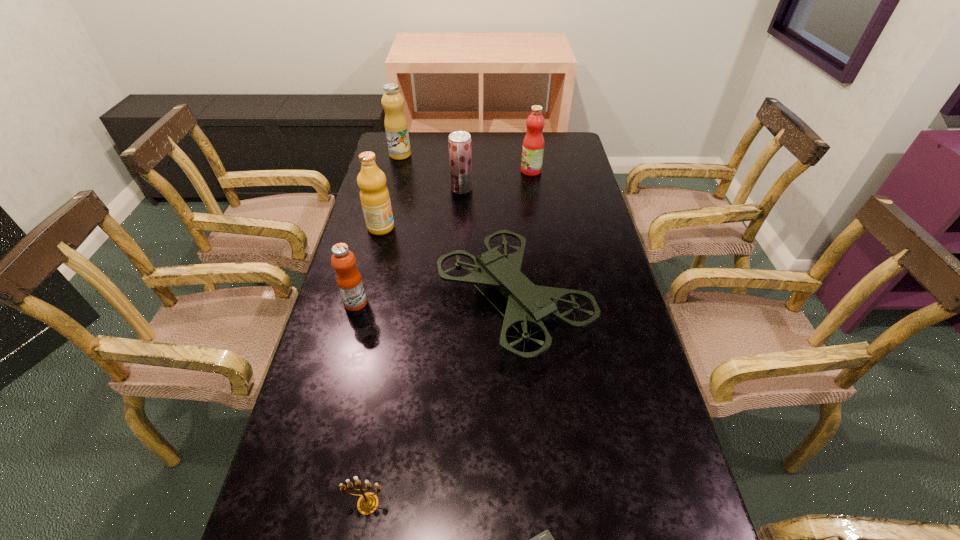
At what (x,y) coordinates should I click in order to perform the action: click on unoccupied area between the second nearest object and the farthest object. Please return your answer as a coordinate pair (x, y). Looking at the image, I should click on (384, 329).

Identify the location of empty space that is in between the nearest fruit juice and the drone. (434, 303).

At what (x,y) coordinates should I click in order to perform the action: click on free space between the candelabrum and the drone. Please return your answer as a coordinate pair (x, y). Looking at the image, I should click on (441, 403).

Locate which object ranks second in proximity to the shortest object. Please provide its 2D coordinates. Your answer should be formatted as a tuple, i.e. [(x, y)], where the tuple contains the x and y coordinates of a point satisfying the conditions above.

[(527, 303)]

Locate which object is the seventh closest to the farthest object. Please provide its 2D coordinates. Your answer should be formatted as a tuple, i.e. [(x, y)], where the tuple contains the x and y coordinates of a point satisfying the conditions above.

[(544, 539)]

Find the location of a particular element. fruit juice that is the nearest to the nearest object is located at coordinates (348, 278).

Locate an element on the screen. This screenshot has height=540, width=960. fruit juice that is the fourth closest to the farthest object is located at coordinates (x=348, y=278).

Locate an element on the screen. The height and width of the screenshot is (540, 960). free location that satisfies the following two spatial constraints: 1. on the front label of the nearest fruit juice; 2. on the back side of the fourth object from left to right is located at coordinates [x=302, y=504].

This screenshot has height=540, width=960. I want to click on vacant position in the image that satisfies the following two spatial constraints: 1. on the back side of the third nearest fruit juice; 2. on the right side of the second nearest object, so click(x=420, y=188).

At what (x,y) coordinates should I click in order to perform the action: click on vacant space that satisfies the following two spatial constraints: 1. on the front label of the farthest object; 2. on the right side of the drone. Please return your answer as a coordinate pair (x, y). Looking at the image, I should click on (363, 302).